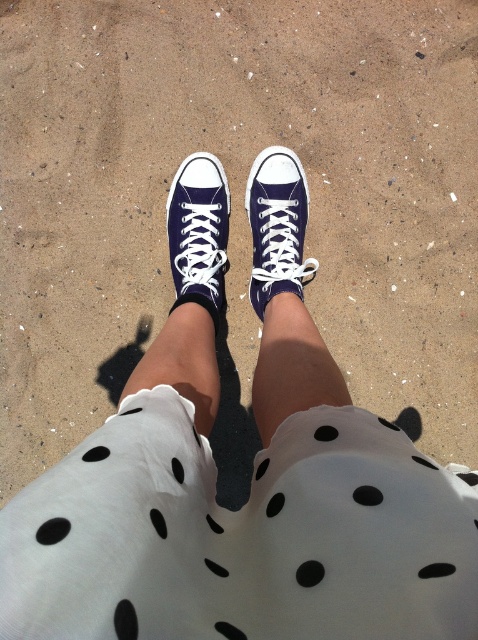
Question: Which of the following is the closest to the observer?

Choices:
 (A) matte canvas sneaker at center
 (B) matte blue canvas shoe at center

Answer: (A)

Question: Is matte blue canvas shoe at center below matte canvas sneaker at center?

Choices:
 (A) yes
 (B) no

Answer: (B)

Question: In this image, where is matte blue canvas shoe at center located relative to matte canvas sneaker at center?

Choices:
 (A) left
 (B) right

Answer: (B)

Question: Does matte blue canvas shoe at center have a smaller size compared to matte canvas sneaker at center?

Choices:
 (A) no
 (B) yes

Answer: (B)